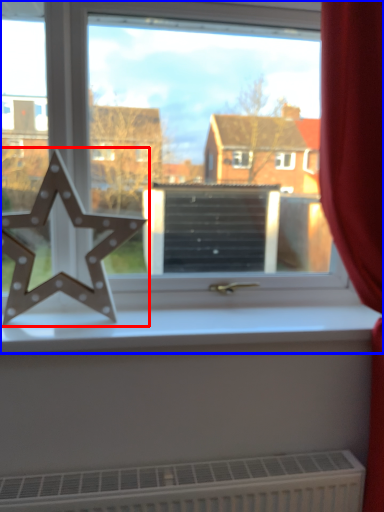
Question: Among these objects, which one is nearest to the camera, letter (highlighted by a red box) or window (highlighted by a blue box)?

Choices:
 (A) letter
 (B) window

Answer: (A)